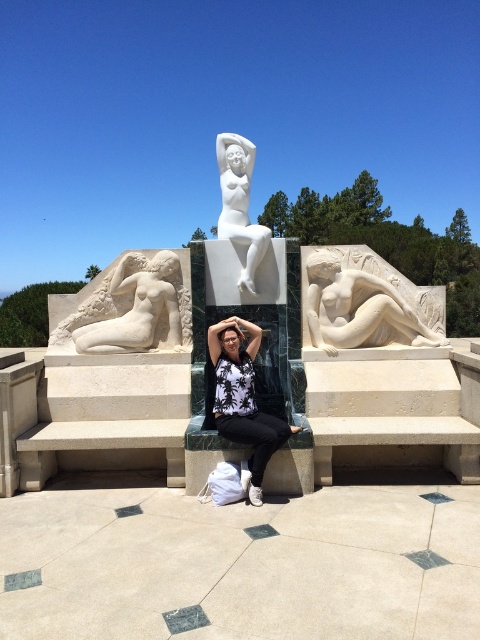
Who is shorter, white fabric bag at center or white marble statue at center?

Standing shorter between the two is white marble statue at center.

Measure the distance between white fabric bag at center and camera.

13.78 feet

Is point (242, 417) closer to viewer compared to point (235, 140)?

Yes.

You are a GUI agent. You are given a task and a screenshot of the screen. Output one action in this format:
    pyautogui.click(x=<x>, y=<y>)
    Task: Click on the white fabric bag at center
    The image size is (480, 640).
    Given the screenshot: What is the action you would take?
    pyautogui.click(x=243, y=401)

Does white marble reclining figure at center have a lesser height compared to white marble statue at center?

In fact, white marble reclining figure at center may be taller than white marble statue at center.

The height and width of the screenshot is (640, 480). What do you see at coordinates (364, 301) in the screenshot?
I see `white marble reclining figure at center` at bounding box center [364, 301].

Where is `white marble reclining figure at center`? white marble reclining figure at center is located at coordinates (364, 301).

Does white marble reclining figure at center appear over white marble reclining figure at left?

Incorrect, white marble reclining figure at center is not positioned above white marble reclining figure at left.

Does point (399, 301) come farther from viewer compared to point (109, 330)?

Yes, point (399, 301) is farther from viewer.

Identify the location of white marble reclining figure at center. The width and height of the screenshot is (480, 640). (364, 301).